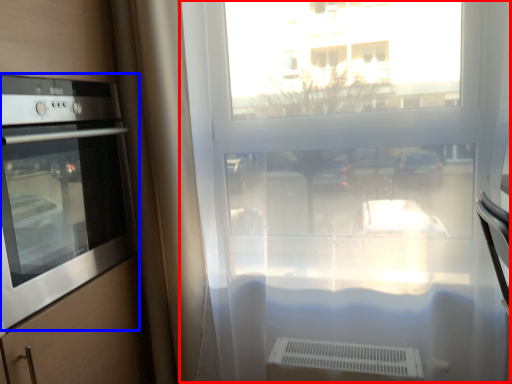
Question: Which object appears closest to the camera in this image, window frame (highlighted by a red box) or home appliance (highlighted by a blue box)?

Choices:
 (A) window frame
 (B) home appliance

Answer: (B)